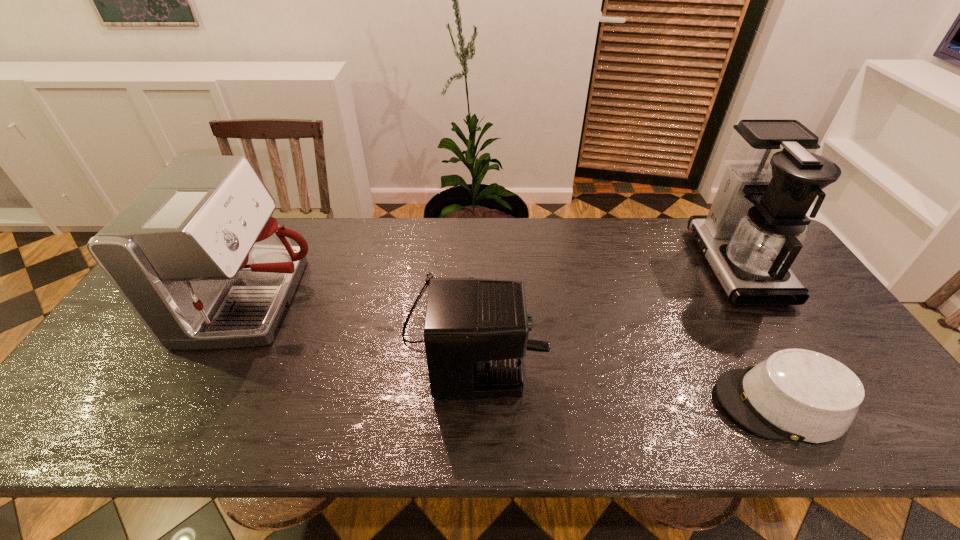
Where is `the rightmost coffee maker`? This screenshot has width=960, height=540. the rightmost coffee maker is located at coordinates (756, 225).

Locate an element on the screen. This screenshot has height=540, width=960. the leftmost object is located at coordinates (197, 255).

At what (x,y) coordinates should I click in order to perform the action: click on the second shortest object. Please return your answer as a coordinate pair (x, y). This screenshot has height=540, width=960. Looking at the image, I should click on (476, 331).

The height and width of the screenshot is (540, 960). I want to click on the shortest coffee maker, so click(476, 331).

Identify the location of the shortest object. (800, 395).

At what (x,y) coordinates should I click in order to perform the action: click on vacant space located 0.140m at the front of the rightmost coffee maker where the controls are located. Please return your answer as a coordinate pair (x, y). The image size is (960, 540). Looking at the image, I should click on (655, 265).

At what (x,y) coordinates should I click in order to perform the action: click on free space located 0.360m at the front of the rightmost coffee maker where the controls are located. Please return your answer as a coordinate pair (x, y). The height and width of the screenshot is (540, 960). Looking at the image, I should click on (584, 265).

You are a GUI agent. You are given a task and a screenshot of the screen. Output one action in this format:
    pyautogui.click(x=<x>, y=<y>)
    Task: Click on the free location located 0.160m at the front of the rightmost coffee maker where the controls are located
    
    Given the screenshot: What is the action you would take?
    pyautogui.click(x=649, y=265)

The height and width of the screenshot is (540, 960). I want to click on vacant region located 0.160m on the front of the leftmost object near the spout, so click(373, 301).

Locate an element on the screen. This screenshot has width=960, height=540. vacant area situated on the front-facing side of the second shortest object is located at coordinates 559,330.